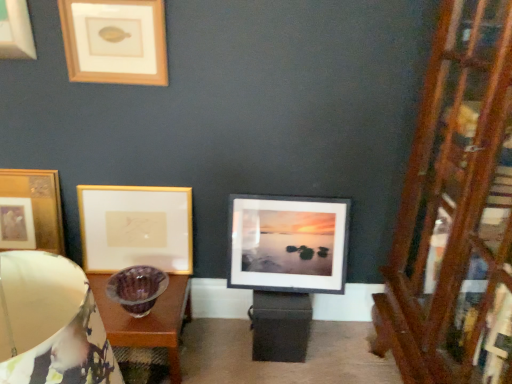
How much space does gold/matte picture frame at upper left, the 3th picture frame positioned from the left, occupy horizontally?

gold/matte picture frame at upper left, the 3th picture frame positioned from the left, is 2.18 inches in width.

Describe the element at coordinates (136, 228) in the screenshot. I see `gold/glossy picture frame at upper left, marked as the second picture frame in a left-to-right arrangement` at that location.

What do you see at coordinates (30, 211) in the screenshot? I see `gold metallic picture frame at upper left, which is counted as the 1th picture frame, starting from the left` at bounding box center [30, 211].

At what (x,y) coordinates should I click in order to perform the action: click on matte purple glass bowl at left. Please return your answer as a coordinate pair (x, y). The width and height of the screenshot is (512, 384). Looking at the image, I should click on (51, 323).

Describe the element at coordinates (288, 244) in the screenshot. Image resolution: width=512 pixels, height=384 pixels. I see `white matte picture frame at center, placed as the first picture frame when sorted from right to left` at that location.

In order to face white matte picture frame at center, which is the 4th picture frame from left to right, should I rotate leftwards or rightwards?

You should look right and rotate roughly 4.482 degrees.

Where is `gold/matte picture frame at upper left, the second picture frame from the right`? gold/matte picture frame at upper left, the second picture frame from the right is located at coordinates (115, 41).

Is wooden at right wider or thinner than gold metallic picture frame at upper left, which is counted as the 1th picture frame, starting from the left?

Considering their sizes, wooden at right looks broader than gold metallic picture frame at upper left, which is counted as the 1th picture frame, starting from the left.

Based on the photo, does wooden at right appear on the right side of gold metallic picture frame at upper left, which is counted as the 1th picture frame, starting from the left?

Yes.

You are a GUI agent. You are given a task and a screenshot of the screen. Output one action in this format:
    pyautogui.click(x=<x>, y=<y>)
    Task: Click on the 2nd picture frame behind the wooden at right, counting from the anchor's position
    This screenshot has width=512, height=384.
    Given the screenshot: What is the action you would take?
    pyautogui.click(x=30, y=211)

From the image's perspective, who appears lower, wooden at right or gold metallic picture frame at upper left, which is counted as the 1th picture frame, starting from the left?

wooden at right, from the image's perspective.

Does gold/matte picture frame at upper left, the 3th picture frame positioned from the left, come behind wooden at right?

Yes, gold/matte picture frame at upper left, the 3th picture frame positioned from the left, is behind wooden at right.

Which object is positioned more to the left, gold/matte picture frame at upper left, the second picture frame from the right, or wooden at right?

Positioned to the left is gold/matte picture frame at upper left, the second picture frame from the right.

Is gold/matte picture frame at upper left, the second picture frame from the right, situated inside wooden at right or outside?

gold/matte picture frame at upper left, the second picture frame from the right, is outside wooden at right.

From a real-world perspective, is white matte picture frame at center, placed as the first picture frame when sorted from right to left, beneath gold/matte picture frame at upper left, the second picture frame from the right?

Yes.

How far apart are white matte picture frame at center, placed as the first picture frame when sorted from right to left, and gold/matte picture frame at upper left, the 3th picture frame positioned from the left?

white matte picture frame at center, placed as the first picture frame when sorted from right to left, is 32.41 inches from gold/matte picture frame at upper left, the 3th picture frame positioned from the left.

From the image's perspective, is white matte picture frame at center, which is the 4th picture frame from left to right, located above gold/matte picture frame at upper left, the second picture frame from the right?

Actually, white matte picture frame at center, which is the 4th picture frame from left to right, appears below gold/matte picture frame at upper left, the second picture frame from the right, in the image.

Is white matte picture frame at center, which is the 4th picture frame from left to right, turned away from gold/matte picture frame at upper left, the 3th picture frame positioned from the left?

No, white matte picture frame at center, which is the 4th picture frame from left to right,'s orientation is not away from gold/matte picture frame at upper left, the 3th picture frame positioned from the left.

From the image's perspective, is gold/matte picture frame at upper left, the second picture frame from the right, positioned above or below gold/glossy picture frame at upper left, the 3th picture frame in the right-to-left sequence?

gold/matte picture frame at upper left, the second picture frame from the right, is above gold/glossy picture frame at upper left, the 3th picture frame in the right-to-left sequence.

Are gold/matte picture frame at upper left, the 3th picture frame positioned from the left, and gold/glossy picture frame at upper left, the 3th picture frame in the right-to-left sequence, far apart?

No, gold/matte picture frame at upper left, the 3th picture frame positioned from the left, is not far away from gold/glossy picture frame at upper left, the 3th picture frame in the right-to-left sequence.

Is gold/glossy picture frame at upper left, the 3th picture frame in the right-to-left sequence, located within gold/matte picture frame at upper left, the second picture frame from the right?

No, gold/glossy picture frame at upper left, the 3th picture frame in the right-to-left sequence, is not inside gold/matte picture frame at upper left, the second picture frame from the right.

Which object is closer to the camera taking this photo, gold/matte picture frame at upper left, the second picture frame from the right, or gold/glossy picture frame at upper left, marked as the second picture frame in a left-to-right arrangement?

Positioned in front is gold/matte picture frame at upper left, the second picture frame from the right.

Considering the relative sizes of white matte picture frame at center, which is the 4th picture frame from left to right, and wooden at right in the image provided, is white matte picture frame at center, which is the 4th picture frame from left to right, bigger than wooden at right?

Actually, white matte picture frame at center, which is the 4th picture frame from left to right, might be smaller than wooden at right.

How many degrees apart are the facing directions of white matte picture frame at center, placed as the first picture frame when sorted from right to left, and wooden at right?

90 degrees.

Is white matte picture frame at center, which is the 4th picture frame from left to right, located outside wooden at right?

Absolutely, white matte picture frame at center, which is the 4th picture frame from left to right, is external to wooden at right.

Locate an element on the screen. This screenshot has width=512, height=384. dresser above the white matte picture frame at center, placed as the first picture frame when sorted from right to left (from a real-world perspective) is located at coordinates (456, 211).

From the image's perspective, would you say gold/matte picture frame at upper left, the second picture frame from the right, is shown under white matte picture frame at center, which is the 4th picture frame from left to right?

No, from the image's perspective, gold/matte picture frame at upper left, the second picture frame from the right, is not beneath white matte picture frame at center, which is the 4th picture frame from left to right.

Could you tell me if gold/matte picture frame at upper left, the 3th picture frame positioned from the left, is facing white matte picture frame at center, which is the 4th picture frame from left to right?

No.

Who is taller, gold/matte picture frame at upper left, the second picture frame from the right, or white matte picture frame at center, which is the 4th picture frame from left to right?

With more height is white matte picture frame at center, which is the 4th picture frame from left to right.

Is the surface of gold/matte picture frame at upper left, the second picture frame from the right, in direct contact with white matte picture frame at center, which is the 4th picture frame from left to right?

gold/matte picture frame at upper left, the second picture frame from the right, and white matte picture frame at center, which is the 4th picture frame from left to right, are clearly separated.

Which object is wider, wooden at right or gold/glossy picture frame at upper left, the 3th picture frame in the right-to-left sequence?

With larger width is wooden at right.

Could you tell me if wooden at right is turned towards gold/glossy picture frame at upper left, the 3th picture frame in the right-to-left sequence?

Yes, wooden at right is facing gold/glossy picture frame at upper left, the 3th picture frame in the right-to-left sequence.

Does point (483, 371) appear closer or farther from the camera than point (81, 214)?

Point (483, 371) is positioned closer to the camera compared to point (81, 214).

Locate an element on the screen. Image resolution: width=512 pixels, height=384 pixels. picture frame that is the 1st object directly below the wooden at right (from a real-world perspective) is located at coordinates (30, 211).

Find the location of `dresser that is in front of the gold/matte picture frame at upper left, the 3th picture frame positioned from the left`. dresser that is in front of the gold/matte picture frame at upper left, the 3th picture frame positioned from the left is located at coordinates (456, 211).

Based on their spatial positions, is matte purple glass bowl at left or gold/matte picture frame at upper left, the 3th picture frame positioned from the left, closer to wooden at right?

Based on the image, matte purple glass bowl at left appears to be nearer to wooden at right.

Which object lies nearer to the anchor point gold/matte picture frame at upper left, the second picture frame from the right, white matte picture frame at center, which is the 4th picture frame from left to right, or wooden at right?

The object closer to gold/matte picture frame at upper left, the second picture frame from the right, is white matte picture frame at center, which is the 4th picture frame from left to right.

Estimate the real-world distances between objects in this image. Which object is further from gold/matte picture frame at upper left, the second picture frame from the right, wooden at right or gold metallic picture frame at upper left, marked as the fourth picture frame in a right-to-left arrangement?

The object further to gold/matte picture frame at upper left, the second picture frame from the right, is wooden at right.

Estimate the real-world distances between objects in this image. Which object is closer to white matte picture frame at center, placed as the first picture frame when sorted from right to left, gold/glossy picture frame at upper left, marked as the second picture frame in a left-to-right arrangement, or gold metallic picture frame at upper left, marked as the fourth picture frame in a right-to-left arrangement?

The object closer to white matte picture frame at center, placed as the first picture frame when sorted from right to left, is gold/glossy picture frame at upper left, marked as the second picture frame in a left-to-right arrangement.

From the picture: Which object lies nearer to the anchor point gold metallic picture frame at upper left, marked as the fourth picture frame in a right-to-left arrangement, matte purple glass bowl at left or gold/glossy picture frame at upper left, the 3th picture frame in the right-to-left sequence?

Based on the image, gold/glossy picture frame at upper left, the 3th picture frame in the right-to-left sequence, appears to be nearer to gold metallic picture frame at upper left, marked as the fourth picture frame in a right-to-left arrangement.

Estimate the real-world distances between objects in this image. Which object is further from gold metallic picture frame at upper left, marked as the fourth picture frame in a right-to-left arrangement, gold/matte picture frame at upper left, the 3th picture frame positioned from the left, or wooden at right?

Among the two, wooden at right is located further to gold metallic picture frame at upper left, marked as the fourth picture frame in a right-to-left arrangement.

Based on their spatial positions, is gold metallic picture frame at upper left, which is counted as the 1th picture frame, starting from the left, or gold/matte picture frame at upper left, the 3th picture frame positioned from the left, closer to matte purple glass bowl at left?

gold/matte picture frame at upper left, the 3th picture frame positioned from the left, is closer to matte purple glass bowl at left.

Looking at the image, which one is located further to gold metallic picture frame at upper left, which is counted as the 1th picture frame, starting from the left, white matte picture frame at center, placed as the first picture frame when sorted from right to left, or gold/glossy picture frame at upper left, marked as the second picture frame in a left-to-right arrangement?

white matte picture frame at center, placed as the first picture frame when sorted from right to left, is positioned further to the anchor gold metallic picture frame at upper left, which is counted as the 1th picture frame, starting from the left.

Locate an element on the screen. table lamp between gold/matte picture frame at upper left, the 3th picture frame positioned from the left, and wooden at right, in the horizontal direction is located at coordinates (51, 323).

Find the location of `dresser between matte purple glass bowl at left and white matte picture frame at center, which is the 4th picture frame from left to right, in the front-back direction`. dresser between matte purple glass bowl at left and white matte picture frame at center, which is the 4th picture frame from left to right, in the front-back direction is located at coordinates (456, 211).

The width and height of the screenshot is (512, 384). I want to click on dresser located between matte purple glass bowl at left and gold/glossy picture frame at upper left, marked as the second picture frame in a left-to-right arrangement, in the depth direction, so click(x=456, y=211).

Find the location of a particular element. The width and height of the screenshot is (512, 384). picture frame positioned between matte purple glass bowl at left and gold metallic picture frame at upper left, marked as the fourth picture frame in a right-to-left arrangement, from near to far is located at coordinates (x=115, y=41).